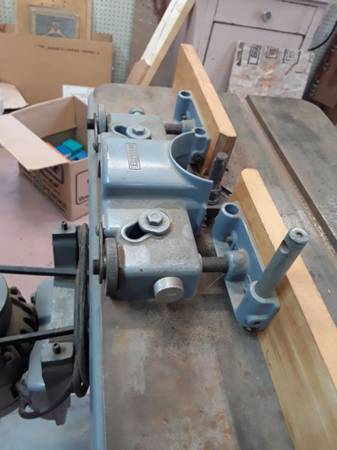
Where is `large cardboard box`? Image resolution: width=337 pixels, height=450 pixels. large cardboard box is located at coordinates (49, 65).